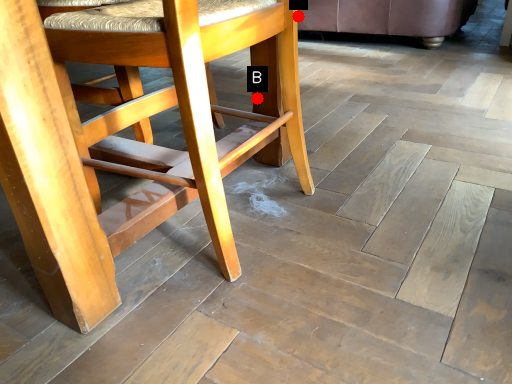
Question: Two points are circled on the image, labeled by A and B beside each circle. Which of the following is the closest to the observer?

Choices:
 (A) A is closer
 (B) B is closer

Answer: (B)